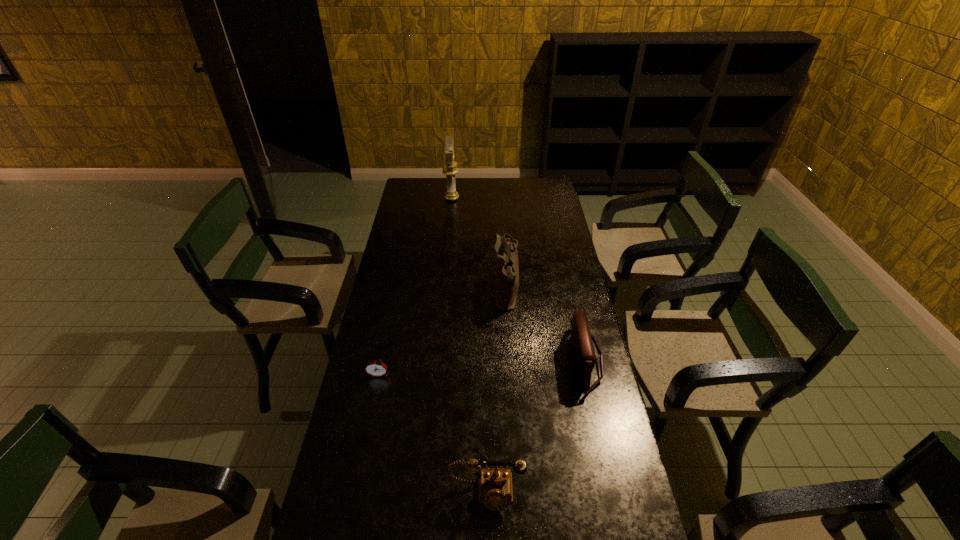
Identify the location of object that is at the right edge. (581, 339).

The height and width of the screenshot is (540, 960). I want to click on free space at the far edge, so click(509, 193).

Locate an element on the screen. The height and width of the screenshot is (540, 960). blank space at the left edge of the desktop is located at coordinates tap(417, 244).

Where is `vacant space at the right edge of the desktop`? This screenshot has width=960, height=540. vacant space at the right edge of the desktop is located at coordinates (538, 222).

At what (x,y) coordinates should I click in order to perform the action: click on free space between the second farthest object and the award. Please return your answer as a coordinate pair (x, y). Looking at the image, I should click on (479, 246).

This screenshot has height=540, width=960. I want to click on empty space that is in between the alarm clock and the farthest object, so click(415, 287).

Locate an element on the screen. free space that is in between the nearest object and the taller shoulder bag is located at coordinates (495, 394).

Identify the location of free spot between the nearest object and the rightmost object. Image resolution: width=960 pixels, height=540 pixels. (536, 427).

The width and height of the screenshot is (960, 540). In order to click on vacant region between the alarm clock and the nearest object in this screenshot , I will do `click(432, 434)`.

Locate an element on the screen. This screenshot has width=960, height=540. vacant point located between the alarm clock and the farthest object is located at coordinates (415, 287).